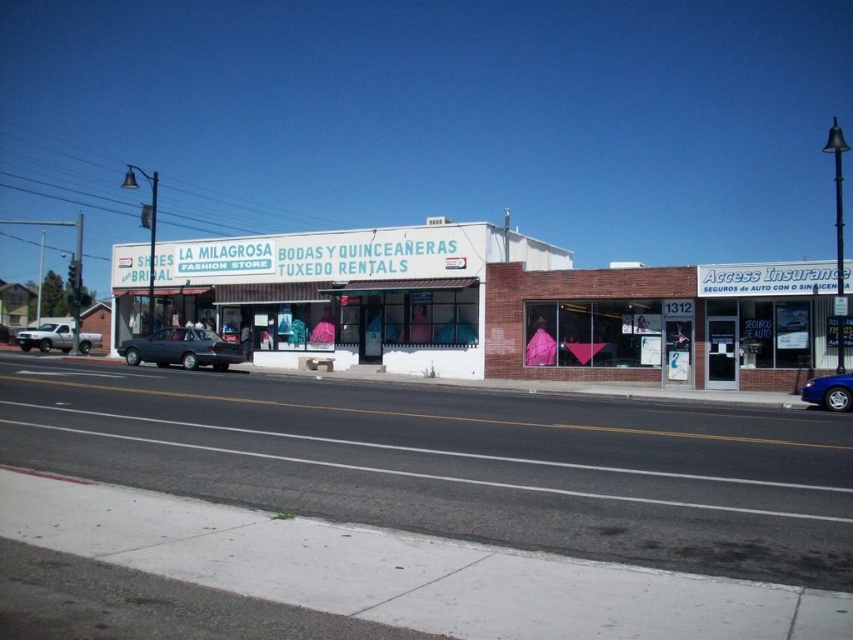
Question: Observing the image, what is the correct spatial positioning of matte black sedan at center in reference to blue metallic car at lower right?

Choices:
 (A) left
 (B) right

Answer: (A)

Question: Which object appears closest to the camera in this image?

Choices:
 (A) silver metallic truck at left
 (B) matte black sedan at center
 (C) blue metallic car at lower right

Answer: (C)

Question: Which point is farther from the camera taking this photo?

Choices:
 (A) (810, 385)
 (B) (70, 337)

Answer: (B)

Question: Is matte black sedan at center wider than blue metallic car at lower right?

Choices:
 (A) no
 (B) yes

Answer: (B)

Question: Estimate the real-world distances between objects in this image. Which object is closer to the silver metallic truck at left?

Choices:
 (A) blue metallic car at lower right
 (B) matte black sedan at center

Answer: (B)

Question: Can you confirm if matte black sedan at center is wider than blue metallic car at lower right?

Choices:
 (A) yes
 (B) no

Answer: (A)